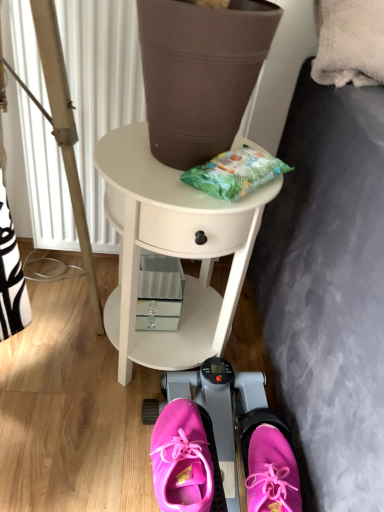
Question: Does pink fabric sneakers at lower center, placed as the second footwear when sorted from left to right, lie behind pink fabric sneakers at center?

Choices:
 (A) no
 (B) yes

Answer: (A)

Question: Could pink fabric sneakers at center be considered to be inside pink fabric sneakers at lower center, arranged as the 1th footwear when viewed from the right?

Choices:
 (A) no
 (B) yes

Answer: (A)

Question: Does pink fabric sneakers at lower center, placed as the second footwear when sorted from left to right, appear on the left side of pink fabric sneakers at center?

Choices:
 (A) no
 (B) yes

Answer: (A)

Question: Does pink fabric sneakers at lower center, placed as the second footwear when sorted from left to right, turn towards pink fabric sneakers at center?

Choices:
 (A) yes
 (B) no

Answer: (B)

Question: Does pink fabric sneakers at lower center, placed as the second footwear when sorted from left to right, have a lesser height compared to pink fabric sneakers at center?

Choices:
 (A) yes
 (B) no

Answer: (A)

Question: Is pink fabric shoe at lower center, which is counted as the 1th footwear, starting from the left, bigger or smaller than pink fabric sneakers at lower center, arranged as the 1th footwear when viewed from the right?

Choices:
 (A) small
 (B) big

Answer: (A)

Question: From their relative heights in the image, would you say pink fabric shoe at lower center, which is counted as the 1th footwear, starting from the left, is taller or shorter than pink fabric sneakers at lower center, placed as the second footwear when sorted from left to right?

Choices:
 (A) short
 (B) tall

Answer: (A)

Question: Looking at their shapes, would you say pink fabric shoe at lower center, which is counted as the 1th footwear, starting from the left, is wider or thinner than pink fabric sneakers at lower center, arranged as the 1th footwear when viewed from the right?

Choices:
 (A) wide
 (B) thin

Answer: (A)

Question: From the image's perspective, is pink fabric shoe at lower center, which is counted as the 1th footwear, starting from the left, positioned above or below pink fabric sneakers at lower center, placed as the second footwear when sorted from left to right?

Choices:
 (A) below
 (B) above

Answer: (B)

Question: Based on their positions, is pink fabric sneakers at center located to the left or right of pink fabric sneakers at lower center, arranged as the 1th footwear when viewed from the right?

Choices:
 (A) left
 (B) right

Answer: (A)

Question: Looking at their shapes, would you say pink fabric sneakers at center is wider or thinner than pink fabric sneakers at lower center, placed as the second footwear when sorted from left to right?

Choices:
 (A) thin
 (B) wide

Answer: (B)

Question: Is pink fabric sneakers at center situated inside pink fabric sneakers at lower center, arranged as the 1th footwear when viewed from the right, or outside?

Choices:
 (A) outside
 (B) inside

Answer: (A)

Question: From the image's perspective, is pink fabric sneakers at center located above or below pink fabric sneakers at lower center, arranged as the 1th footwear when viewed from the right?

Choices:
 (A) above
 (B) below

Answer: (B)

Question: From the image's perspective, is wooden tripod at left located above or below pink fabric shoe at lower center, which is counted as the 1th footwear, starting from the left?

Choices:
 (A) below
 (B) above

Answer: (B)

Question: In terms of height, does wooden tripod at left look taller or shorter compared to pink fabric shoe at lower center, which is counted as the 1th footwear, starting from the left?

Choices:
 (A) short
 (B) tall

Answer: (B)